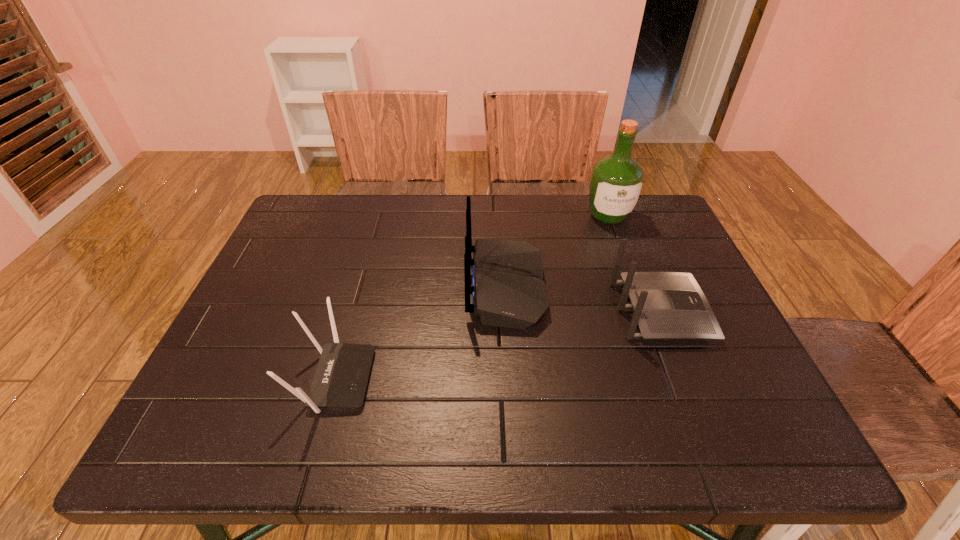
Where is `the farthest object`? The height and width of the screenshot is (540, 960). the farthest object is located at coordinates (616, 182).

Where is `the tallest object`? The height and width of the screenshot is (540, 960). the tallest object is located at coordinates [616, 182].

Identify the location of the tallest router. (509, 290).

Locate an element on the screen. This screenshot has height=540, width=960. the second router from left to right is located at coordinates (509, 290).

This screenshot has height=540, width=960. In order to click on the rightmost router in this screenshot , I will do `click(666, 305)`.

You are a GUI agent. You are given a task and a screenshot of the screen. Output one action in this format:
    pyautogui.click(x=<x>, y=<y>)
    Task: Click on the leftmost router
    This screenshot has width=960, height=540.
    Given the screenshot: What is the action you would take?
    (340, 381)

Locate an element on the screen. This screenshot has height=540, width=960. the shortest object is located at coordinates (340, 381).

Find the location of `vacant space situated 0.210m on the front-facing side of the liquor`. vacant space situated 0.210m on the front-facing side of the liquor is located at coordinates (632, 279).

You are a GUI agent. You are given a task and a screenshot of the screen. Output one action in this format:
    pyautogui.click(x=<x>, y=<y>)
    Task: Click on the free space located on the back of the second tallest object
    Image resolution: width=960 pixels, height=540 pixels.
    Given the screenshot: What is the action you would take?
    pyautogui.click(x=446, y=287)

The width and height of the screenshot is (960, 540). Find the location of `free space located 0.100m on the back of the second tallest object`. free space located 0.100m on the back of the second tallest object is located at coordinates tap(427, 287).